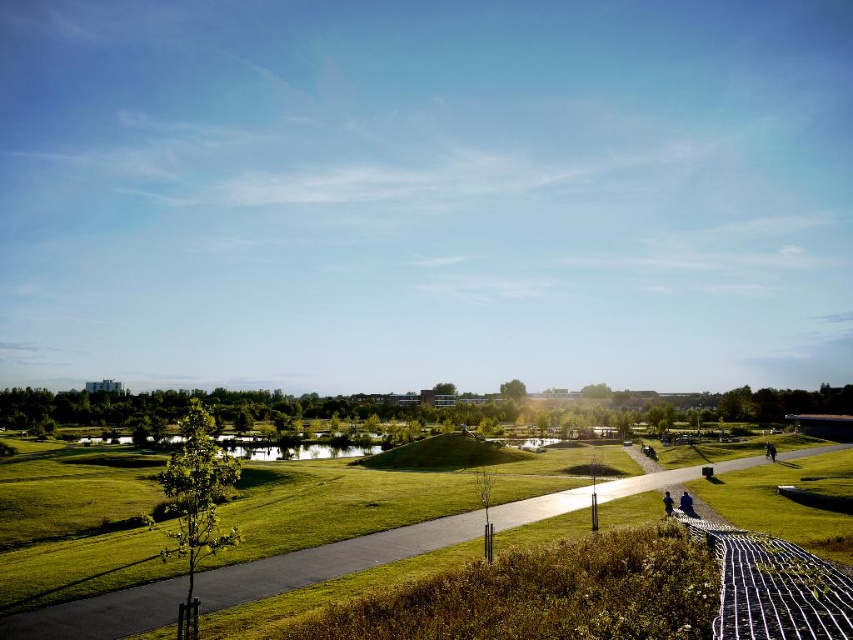
Consider the image. Is green grassy park at center above white mesh fence at lower right?

No, green grassy park at center is not above white mesh fence at lower right.

Who is positioned more to the left, green grassy park at center or white mesh fence at lower right?

Positioned to the left is white mesh fence at lower right.

Between point (218, 570) and point (784, 584), which one is positioned behind?

Positioned behind is point (218, 570).

This screenshot has width=853, height=640. In order to click on green grassy park at center in this screenshot , I will do `click(328, 561)`.

Based on the photo, who is shorter, white mesh fence at lower right or dark blue jeans at lower right?

dark blue jeans at lower right

Can you confirm if white mesh fence at lower right is wider than dark blue jeans at lower right?

Yes.

Identify the location of white mesh fence at lower right. (773, 586).

Image resolution: width=853 pixels, height=640 pixels. Describe the element at coordinates (328, 561) in the screenshot. I see `green grassy park at center` at that location.

Locate an element on the screen. green grassy park at center is located at coordinates (328, 561).